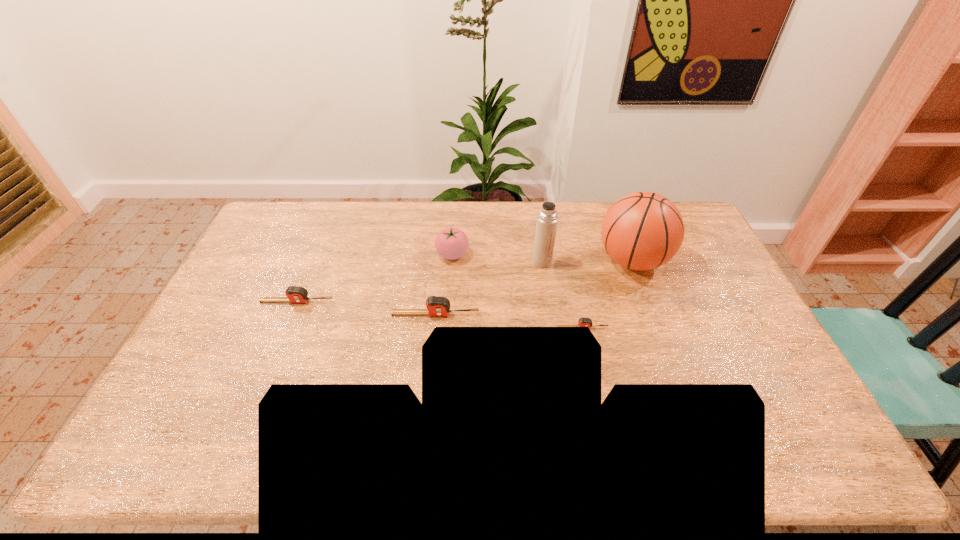
The height and width of the screenshot is (540, 960). I want to click on vacant area that lies between the farthest tape measure and the thermos bottle, so click(420, 281).

I want to click on free space between the nearest object and the tomato, so click(x=517, y=291).

Locate an element on the screen. unoccupied position between the thermos bottle and the tomato is located at coordinates (497, 258).

What are the coordinates of `free space that is in between the leftmost tape measure and the thermos bottle` in the screenshot? It's located at (420, 281).

The width and height of the screenshot is (960, 540). What are the coordinates of `vacant area that lies between the basketball and the thermos bottle` in the screenshot? It's located at (588, 261).

Find the location of a particular element. Image resolution: width=960 pixels, height=540 pixels. the second closest object relative to the second farthest tape measure is located at coordinates (451, 243).

Where is `object that can be found as the closest to the nearest tape measure`? This screenshot has height=540, width=960. object that can be found as the closest to the nearest tape measure is located at coordinates (642, 231).

Locate which tape measure is the third closest to the fourth shortest object. Please provide its 2D coordinates. Your answer should be formatted as a tuple, i.e. [(x, y)], where the tuple contains the x and y coordinates of a point satisfying the conditions above.

[(583, 322)]

The height and width of the screenshot is (540, 960). In order to click on the closest tape measure to the rightmost object in this screenshot , I will do `click(583, 322)`.

The image size is (960, 540). Identify the location of blank area in the image that satisfies the following two spatial constraints: 1. on the front side of the second nearest object; 2. on the right side of the nearest tape measure. (434, 328).